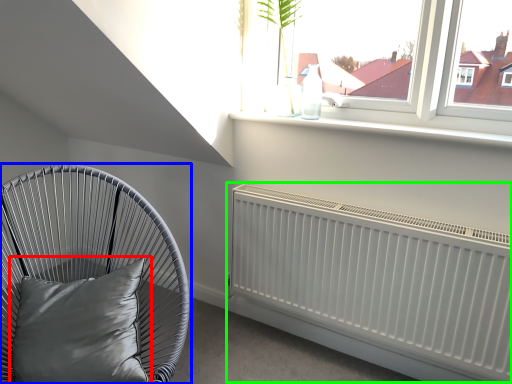
Question: Which is farther away from pillow (highlighted by a red box)? furniture (highlighted by a blue box) or radiator (highlighted by a green box)?

Choices:
 (A) furniture
 (B) radiator

Answer: (B)